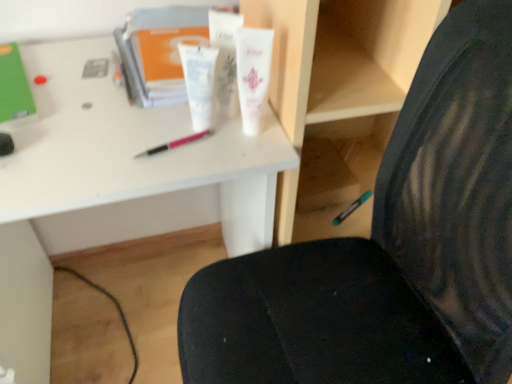
In order to click on free point in front of white glossy tube at center, positioned as the 3th toiletry in right-to-left order in this screenshot , I will do `click(180, 163)`.